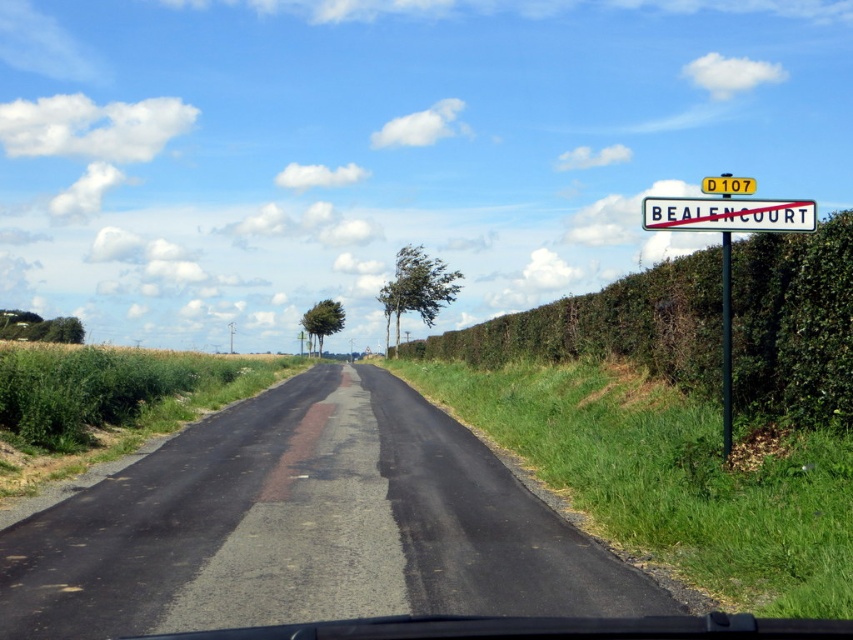
You are driving a car and see the green leafy hedge at right and the yellow plastic sign at upper center ahead. Which object is closer to the left side of the road?

The green leafy hedge at right is to the left of the yellow plastic sign at upper center, so the green leafy hedge at right is closer to the left side of the road.

You are a driver approaching the road and notice two signs ahead. The white plastic sign at upper right and the yellow plastic sign at upper center. Which sign is bigger?

The yellow plastic sign at upper center is bigger than the white plastic sign at upper right.

You are driving down the rural road and see the white plastic sign at upper right and the black metal signpost at upper right. Which one is placed higher above the other?

The white plastic sign at upper right is positioned over the black metal signpost at upper right, so it is placed higher.